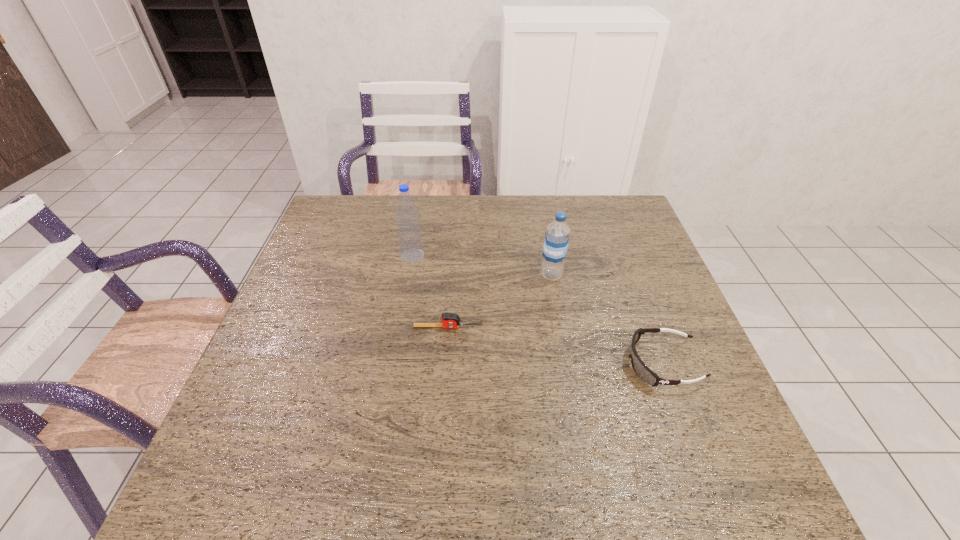
Where is `vacant space located on the label of the second object from right to left`? vacant space located on the label of the second object from right to left is located at coordinates (408, 275).

Image resolution: width=960 pixels, height=540 pixels. Find the location of `free space located on the label of the second object from right to left`. free space located on the label of the second object from right to left is located at coordinates (444, 275).

Find the location of `free spot located on the front and sides of the third tallest object`. free spot located on the front and sides of the third tallest object is located at coordinates (467, 364).

Image resolution: width=960 pixels, height=540 pixels. What are the coordinates of `vacant point located 0.380m on the front and sides of the third tallest object` in the screenshot? It's located at (462, 364).

Identify the location of free location located on the front and sides of the third tallest object. The image size is (960, 540). (540, 364).

Locate an element on the screen. This screenshot has width=960, height=540. vacant point located 0.330m on the left of the third farthest object is located at coordinates (281, 327).

Locate an element on the screen. Image resolution: width=960 pixels, height=540 pixels. object positioned at the right edge is located at coordinates (643, 372).

Find the location of a particular element. The width and height of the screenshot is (960, 540). vacant space at the far edge of the desktop is located at coordinates (378, 210).

Identify the location of vacant space at the left edge of the desktop. This screenshot has height=540, width=960. (294, 376).

Find the location of `free space at the right edge of the desktop`. free space at the right edge of the desktop is located at coordinates (631, 284).